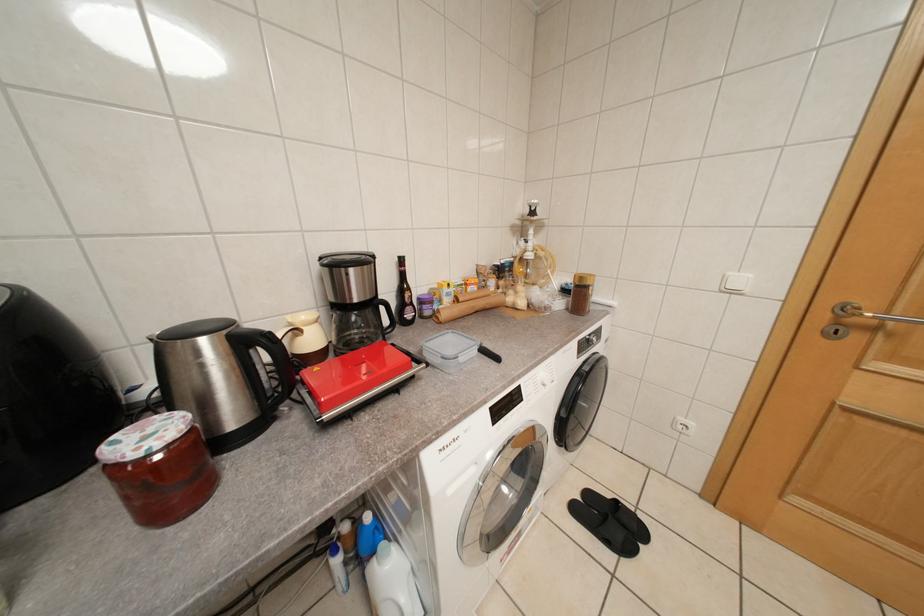
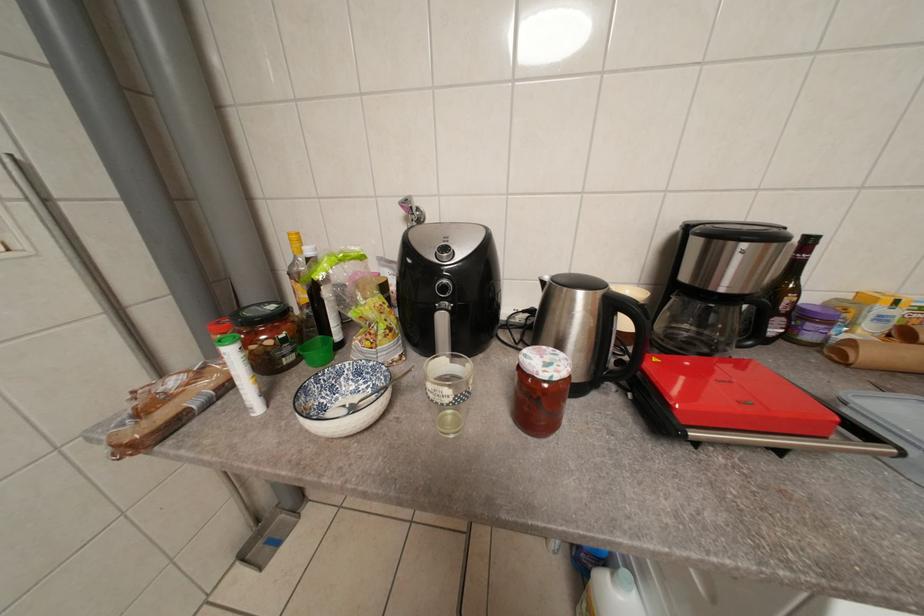
Question: The camera is either moving clockwise (left) or counter-clockwise (right) around the object. The first image is from the beginning of the video and the second image is from the end. Is the camera moving left or right when shooting the video?

Choices:
 (A) Left
 (B) Right

Answer: (B)